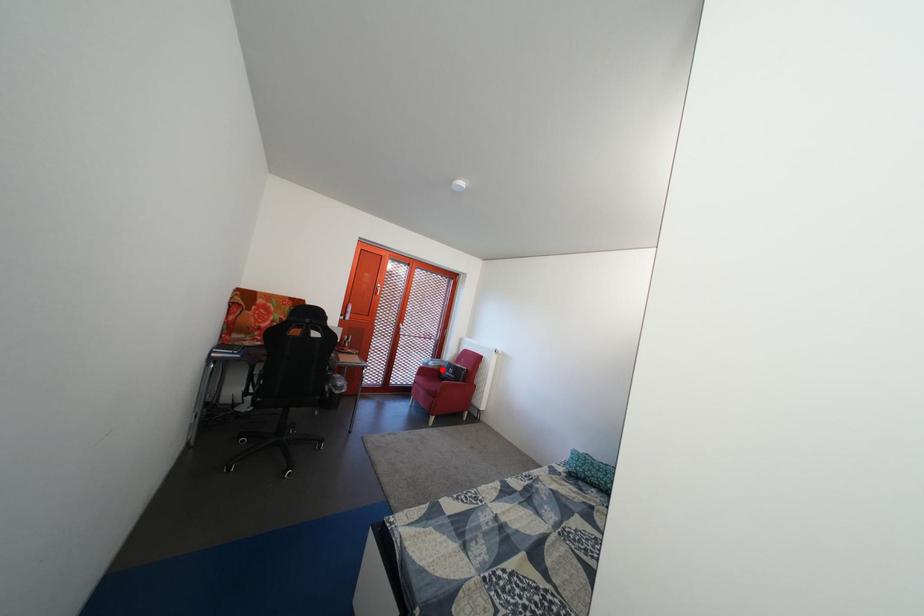
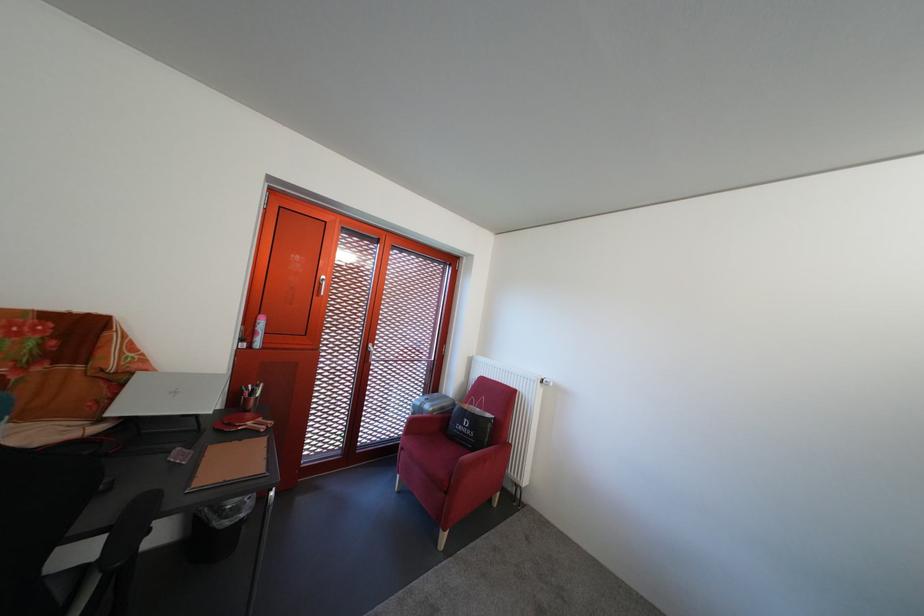
Where in the second image is the point corresponding to the highlighted location from the first image?

(439, 413)